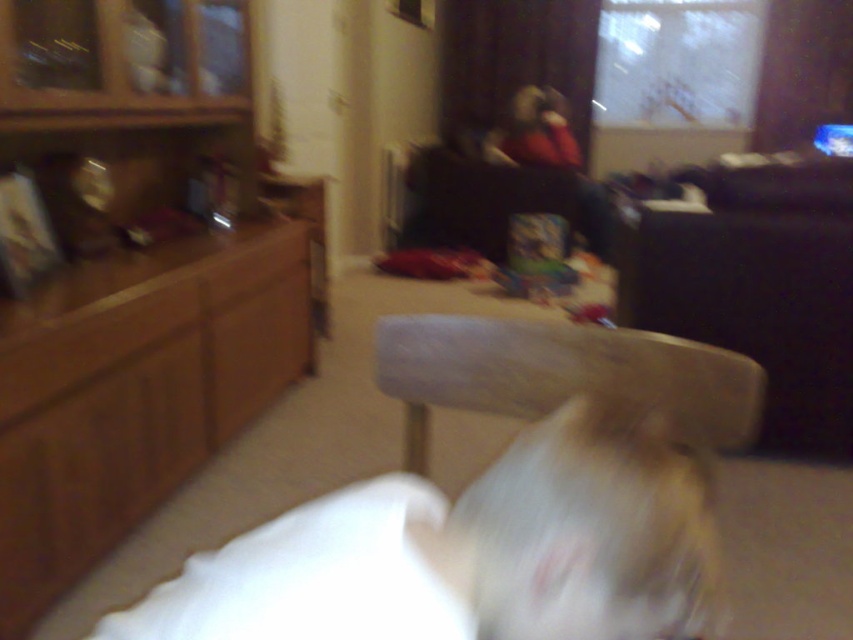
Describe the element at coordinates (126, 275) in the screenshot. I see `brown wood dresser at left` at that location.

Who is more distant from viewer, [16,29] or [833,388]?

Point [833,388]

Between point (97, 10) and point (656, 305), which one is positioned in front?

Positioned in front is point (97, 10).

The image size is (853, 640). Identify the location of brown wood dresser at left. (126, 275).

Is point (585, 496) positioned behind point (682, 388)?

No, (585, 496) is closer to viewer.

Is white fur dog at lower center below wooden stool at center?

Correct, white fur dog at lower center is located below wooden stool at center.

Where is `white fur dog at lower center`? This screenshot has height=640, width=853. white fur dog at lower center is located at coordinates (471, 552).

Does black fabric couch at upper right appear on the right side of white fabric pillow at lower center?

Yes, black fabric couch at upper right is to the right of white fabric pillow at lower center.

Who is lower down, black fabric couch at upper right or white fabric pillow at lower center?

white fabric pillow at lower center

This screenshot has height=640, width=853. Find the location of `black fabric couch at upper right`. black fabric couch at upper right is located at coordinates (756, 285).

What are the coordinates of `black fabric couch at upper right` in the screenshot? It's located at (756, 285).